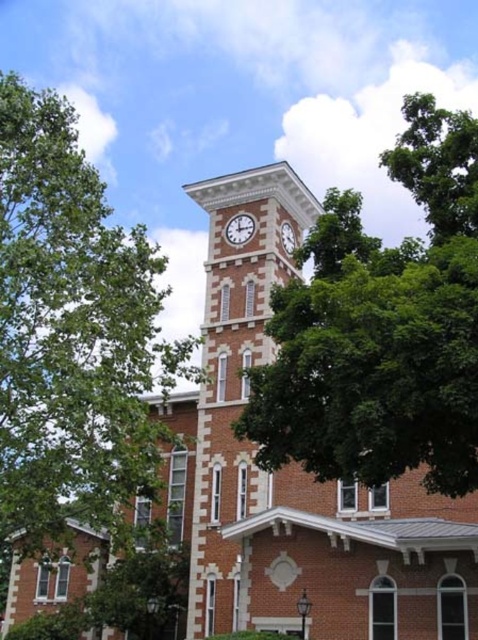
Between point (204, 506) and point (239, 221), which one is positioned in front?

Point (204, 506) is more forward.

The height and width of the screenshot is (640, 478). Describe the element at coordinates (235, 356) in the screenshot. I see `brick clock tower at center` at that location.

Which is in front, point (218, 522) or point (247, 225)?

Point (218, 522) is in front.

The image size is (478, 640). Identify the location of brick clock tower at center. (235, 356).

Is green leafy tree at left smaller than white stone clock at upper center?

Actually, green leafy tree at left might be larger than white stone clock at upper center.

Does point (4, 308) come closer to viewer compared to point (288, 241)?

Yes, point (4, 308) is closer to viewer.

The height and width of the screenshot is (640, 478). I want to click on green leafy tree at left, so click(x=72, y=333).

Is green leafy tree at upper center to the left of brick clock tower at center from the viewer's perspective?

No, green leafy tree at upper center is not to the left of brick clock tower at center.

Image resolution: width=478 pixels, height=640 pixels. What do you see at coordinates (381, 332) in the screenshot?
I see `green leafy tree at upper center` at bounding box center [381, 332].

Where is `green leafy tree at upper center`? The height and width of the screenshot is (640, 478). green leafy tree at upper center is located at coordinates (381, 332).